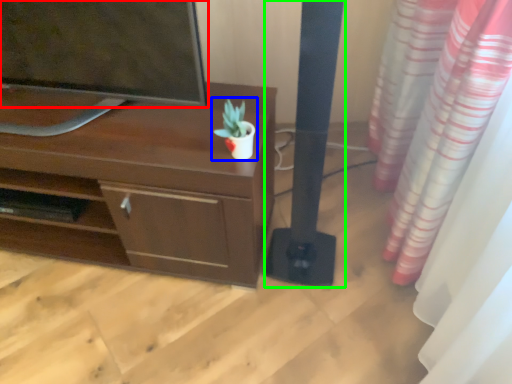
Question: Which object is positioned farthest from television (highlighted by a red box)? Select from houseplant (highlighted by a blue box) and pillar (highlighted by a green box).

Choices:
 (A) houseplant
 (B) pillar

Answer: (B)